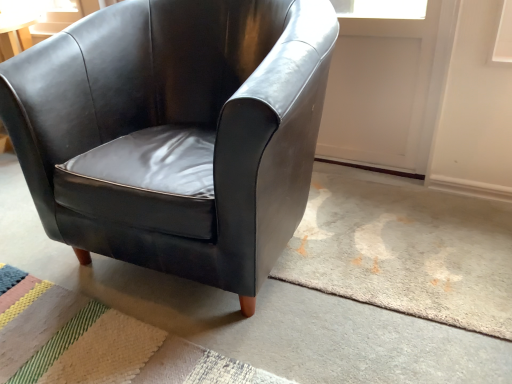
Question: Can you confirm if matte black armchair at center is thinner than matte black armchair at center?

Choices:
 (A) yes
 (B) no

Answer: (A)

Question: Does matte black armchair at center have a smaller size compared to matte black armchair at center?

Choices:
 (A) no
 (B) yes

Answer: (A)

Question: From a real-world perspective, is matte black armchair at center located higher than matte black armchair at center?

Choices:
 (A) no
 (B) yes

Answer: (B)

Question: From the image's perspective, is matte black armchair at center beneath matte black armchair at center?

Choices:
 (A) no
 (B) yes

Answer: (A)

Question: Does matte black armchair at center have a lesser height compared to matte black armchair at center?

Choices:
 (A) no
 (B) yes

Answer: (A)

Question: Does matte black armchair at center have a larger size compared to matte black armchair at center?

Choices:
 (A) yes
 (B) no

Answer: (A)

Question: From the image's perspective, would you say matte black armchair at center is positioned over matte black armchair at center?

Choices:
 (A) yes
 (B) no

Answer: (B)

Question: Considering the relative positions of matte black armchair at center and matte black armchair at center in the image provided, is matte black armchair at center in front of matte black armchair at center?

Choices:
 (A) no
 (B) yes

Answer: (B)

Question: Does matte black armchair at center have a smaller size compared to matte black armchair at center?

Choices:
 (A) yes
 (B) no

Answer: (A)

Question: Does matte black armchair at center appear on the right side of matte black armchair at center?

Choices:
 (A) yes
 (B) no

Answer: (B)

Question: Is matte black armchair at center oriented away from matte black armchair at center?

Choices:
 (A) no
 (B) yes

Answer: (A)

Question: Considering the relative sizes of matte black armchair at center and matte black armchair at center in the image provided, is matte black armchair at center bigger than matte black armchair at center?

Choices:
 (A) yes
 (B) no

Answer: (B)

Question: Is textured beige rug at lower left to the right of matte black armchair at center from the viewer's perspective?

Choices:
 (A) yes
 (B) no

Answer: (B)